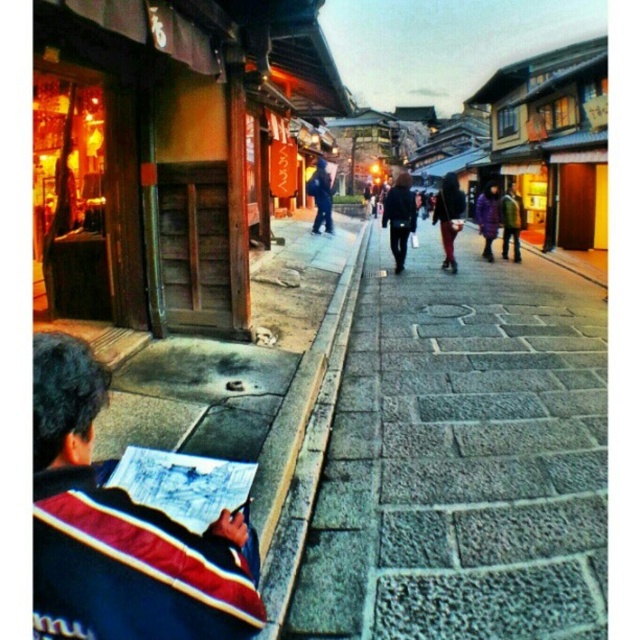
Is striped fleece jacket at lower left to the right of dark blue jacket at center from the viewer's perspective?

In fact, striped fleece jacket at lower left is to the left of dark blue jacket at center.

Does point (97, 589) come in front of point (406, 230)?

Yes, it is in front of point (406, 230).

The height and width of the screenshot is (640, 640). What do you see at coordinates (118, 531) in the screenshot?
I see `striped fleece jacket at lower left` at bounding box center [118, 531].

Where is `striped fleece jacket at lower left`? Image resolution: width=640 pixels, height=640 pixels. striped fleece jacket at lower left is located at coordinates (118, 531).

Is gray concrete curb at center wider than dark blue jeans at center?

In fact, gray concrete curb at center might be narrower than dark blue jeans at center.

Is point (276, 452) less distant than point (440, 198)?

Yes, it is in front of point (440, 198).

Locate an element on the screen. This screenshot has height=640, width=640. gray concrete curb at center is located at coordinates click(x=301, y=444).

Can you confirm if striped fleece jacket at lower left is shorter than purple fabric jacket at center?

Indeed, striped fleece jacket at lower left has a lesser height compared to purple fabric jacket at center.

Can you confirm if striped fleece jacket at lower left is positioned below purple fabric jacket at center?

Yes.

Between point (38, 490) and point (477, 198), which one is positioned behind?

The point (477, 198) is more distant.

Where is `striped fleece jacket at lower left`? The width and height of the screenshot is (640, 640). striped fleece jacket at lower left is located at coordinates click(118, 531).